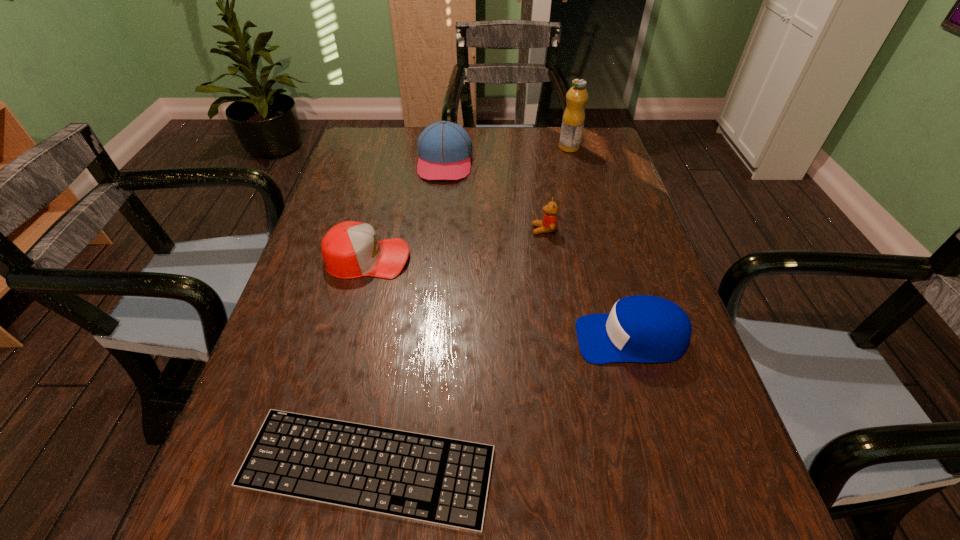
Locate an element on the screen. The width and height of the screenshot is (960, 540). fruit juice is located at coordinates (573, 119).

I want to click on the farthest baseball cap, so click(444, 148).

You are a GUI agent. You are given a task and a screenshot of the screen. Output one action in this format:
    pyautogui.click(x=<x>, y=<y>)
    Task: Click on the second tallest object
    This screenshot has height=540, width=960.
    Given the screenshot: What is the action you would take?
    pyautogui.click(x=444, y=148)

The height and width of the screenshot is (540, 960). Find the location of `teddy bear`. teddy bear is located at coordinates (548, 224).

The height and width of the screenshot is (540, 960). I want to click on the rightmost baseball cap, so click(x=645, y=329).

The width and height of the screenshot is (960, 540). I want to click on the second nearest object, so click(645, 329).

At what (x,y) coordinates should I click in order to perform the action: click on the second farthest baseball cap. Please return your answer as a coordinate pair (x, y). The width and height of the screenshot is (960, 540). Looking at the image, I should click on (350, 249).

Identify the location of computer keyboard. (443, 481).

Locate an element on the screen. This screenshot has height=540, width=960. the nearest object is located at coordinates (443, 481).

Identify the location of vacant position located 0.060m on the front label of the fruit juice. (540, 147).